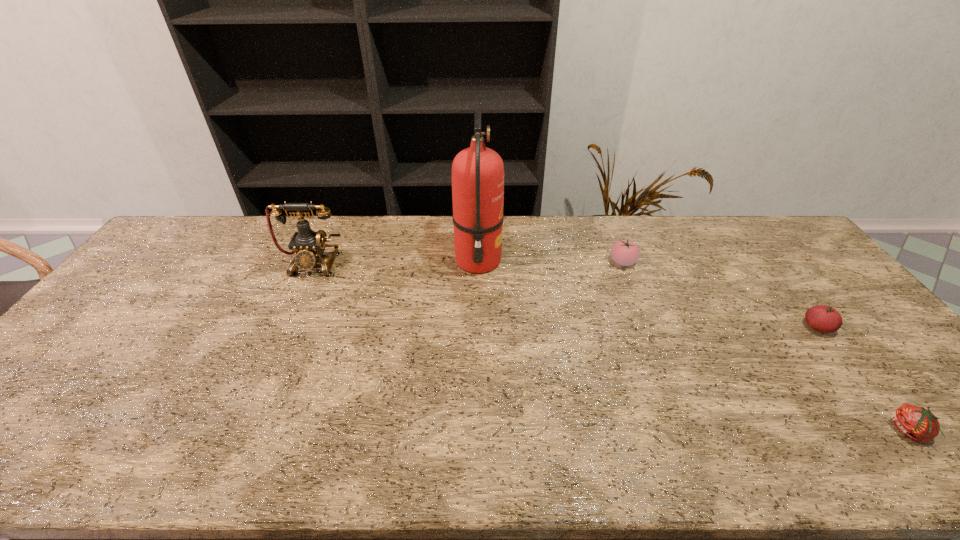
At what (x,y) coordinates should I click in order to perform the action: click on empty location between the shortest tomato and the telephone. Please return your answer as a coordinate pair (x, y). The width and height of the screenshot is (960, 540). Looking at the image, I should click on (612, 347).

Find the location of a particular element. vacant area that lies between the leftmost tomato and the shortest object is located at coordinates (766, 347).

Locate an element on the screen. object that stands as the fourth closest to the third object from left to right is located at coordinates (309, 246).

Find the location of a particular element. object that ranks as the second closest to the leftmost tomato is located at coordinates (823, 318).

Image resolution: width=960 pixels, height=540 pixels. In order to click on tomato object that ranks as the third closest to the tallest object in this screenshot , I will do `click(917, 423)`.

Identify which tomato is the closest to the farthest tomato. Please provide its 2D coordinates. Your answer should be formatted as a tuple, i.e. [(x, y)], where the tuple contains the x and y coordinates of a point satisfying the conditions above.

[(823, 318)]

Where is `vacant space that satisfies the following two spatial constraints: 1. on the front of the fourth shortest object, featuring the rotary dial; 2. on the left side of the nearest object`? Image resolution: width=960 pixels, height=540 pixels. vacant space that satisfies the following two spatial constraints: 1. on the front of the fourth shortest object, featuring the rotary dial; 2. on the left side of the nearest object is located at coordinates (238, 431).

Where is `free region that satisfies the following two spatial constraints: 1. on the side of the second object from left to right with the nozzle and handle; 2. on the right side of the nearest tomato`? This screenshot has height=540, width=960. free region that satisfies the following two spatial constraints: 1. on the side of the second object from left to right with the nozzle and handle; 2. on the right side of the nearest tomato is located at coordinates (477, 431).

Image resolution: width=960 pixels, height=540 pixels. I want to click on blank space that satisfies the following two spatial constraints: 1. on the side of the second object from left to right with the nozzle and handle; 2. on the back side of the nearest tomato, so click(477, 431).

This screenshot has width=960, height=540. What are the coordinates of `vacant region that satisfies the following two spatial constraints: 1. on the front side of the nearest object; 2. on the left side of the third object from left to right` in the screenshot? It's located at (688, 431).